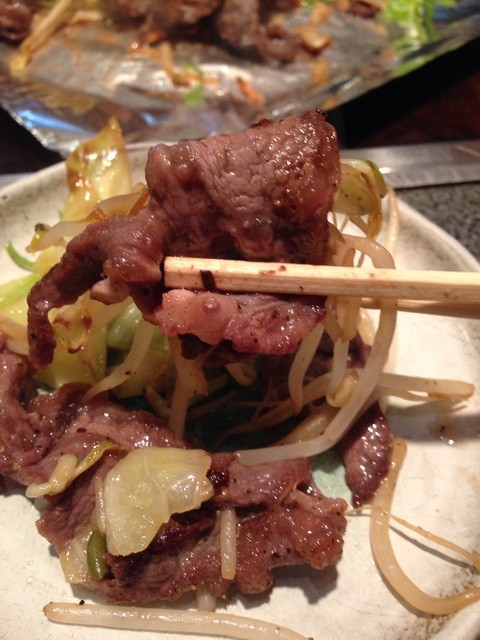
I want to click on chop sticks, so click(x=290, y=269), click(x=411, y=305).